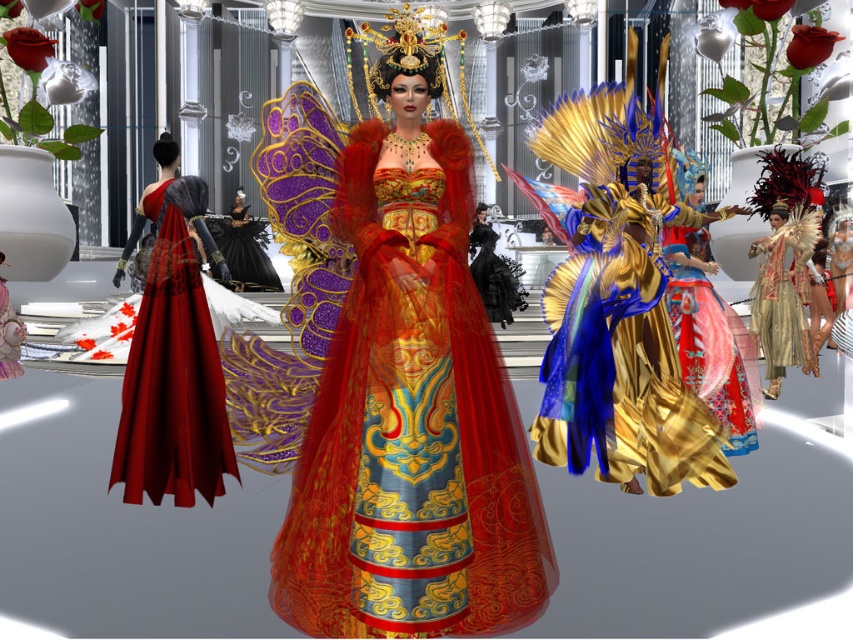
Question: Does matte black gown at left have a greater width compared to shiny gold dress at right?

Choices:
 (A) yes
 (B) no

Answer: (A)

Question: Estimate the real-world distances between objects in this image. Which object is farther from the matte black gown at left?

Choices:
 (A) shiny gold dress at right
 (B) shiny silk gown at center
 (C) shiny gold fabric dress at center

Answer: (A)

Question: From the image, what is the correct spatial relationship of shiny silk gown at center in relation to shiny gold fabric dress at center?

Choices:
 (A) above
 (B) below

Answer: (A)

Question: Estimate the real-world distances between objects in this image. Which object is closer to the shiny silk dress at center?

Choices:
 (A) shiny gold dress at right
 (B) matte black gown at left
 (C) shiny silk gown at center
 (D) black satin gown at center

Answer: (C)

Question: Which object is farther from the camera taking this photo?

Choices:
 (A) shiny gold dress at right
 (B) shiny gold fabric dress at center
 (C) matte black gown at left

Answer: (A)

Question: Is shiny silk gown at center above black satin gown at center?

Choices:
 (A) no
 (B) yes

Answer: (A)